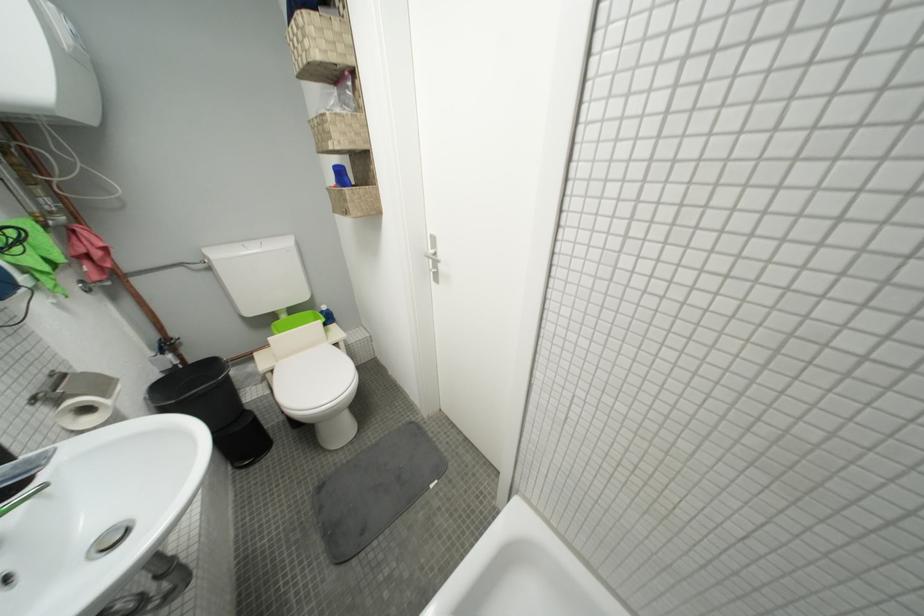
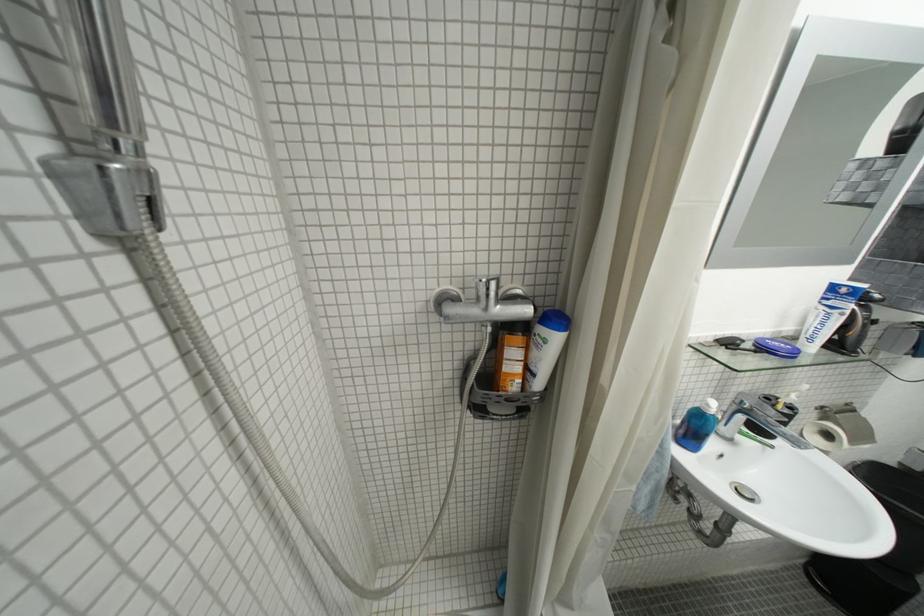
In the second image, find the point that corresponds to (93,411) in the first image.

(836, 438)